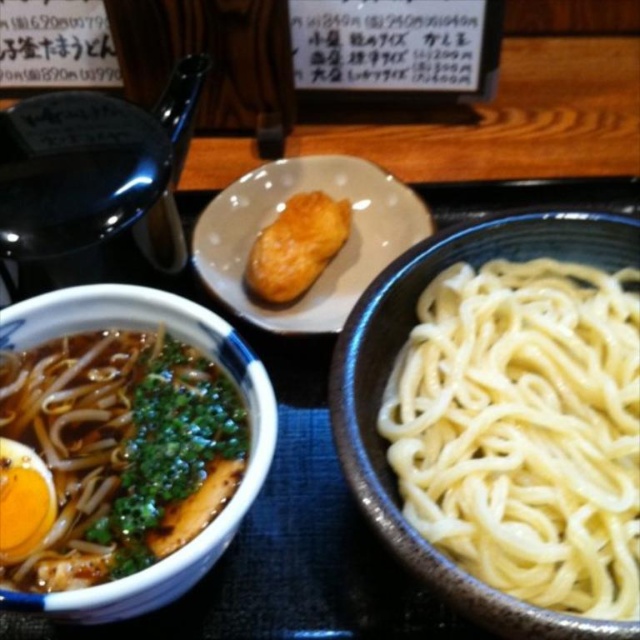
You are a customer at the Japanese restaurant and want to reach for the golden crispy chicken at center. Which direction should you move your hand from the matte ceramic bowl at left to get it?

To reach the golden crispy chicken at center from the matte ceramic bowl at left, you should move your hand to the right since the golden crispy chicken at center is to the right of the matte ceramic bowl at left.

You are a customer at a Japanese restaurant and see the white matte noodles at right and the matte ceramic plate at center on your table. Which item is taller?

The white matte noodles at right is much taller than the matte ceramic plate at center.